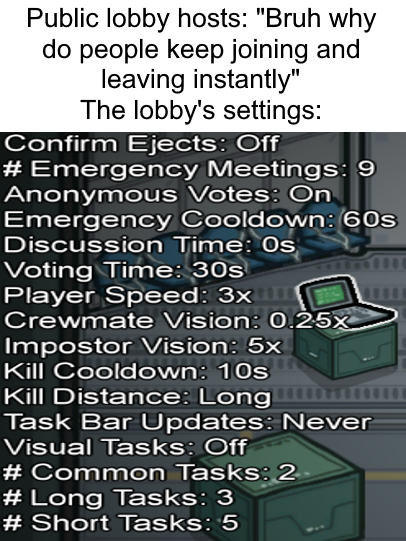
I want to click on floor, so click(374, 395).